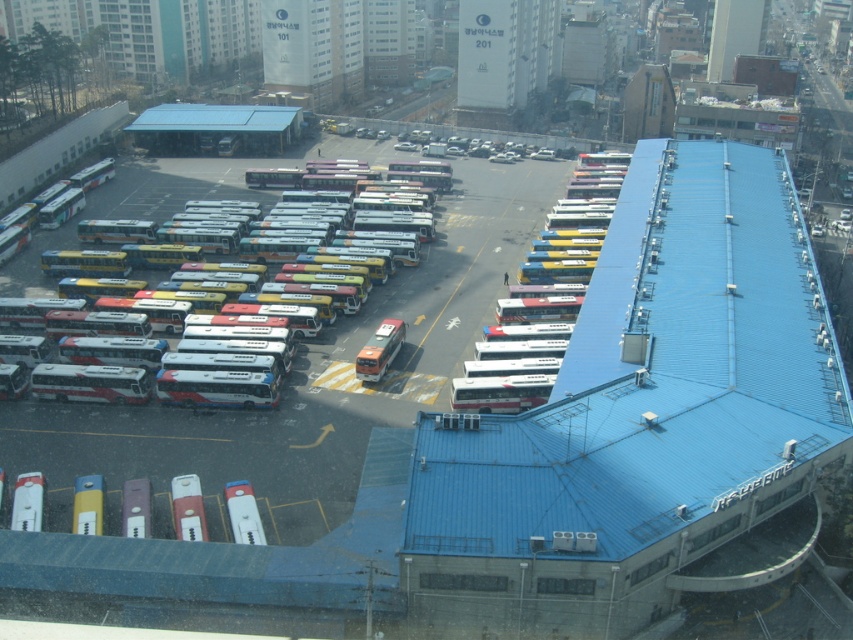
In the scene shown: You are standing at the entrance of the bus depot and want to board the white matte bus at left. The safety regulations state that you must be within 100 meters to board. Can you board the bus from your current position?

The white matte bus at left is 91.88 meters away from you, which is within the 100 meters safety regulation distance. Therefore, you can board the white matte bus at left from your current position.

You are a delivery person who needs to park your van between the white glossy bus at center and the metallic silver bus at lower left. Based on the aerial view, is there enough space between them for your van which is 6 meters long?

The white glossy bus at center is above the metallic silver bus at lower left, meaning they are positioned vertically in the aerial view. Since the distance between them isn

You are a drone operator tasked with capturing aerial footage of the depot. You need to fly your drone from the metallic silver bus at lower left to the nearest building with an address. Which building is closer, the one labeled 101 or 201?

The metallic silver bus at lower left is 67.13 meters away from the nearest building with an address. Since the distance is the same for both 101 and 201, the drone operator can choose either building as they are equally close.